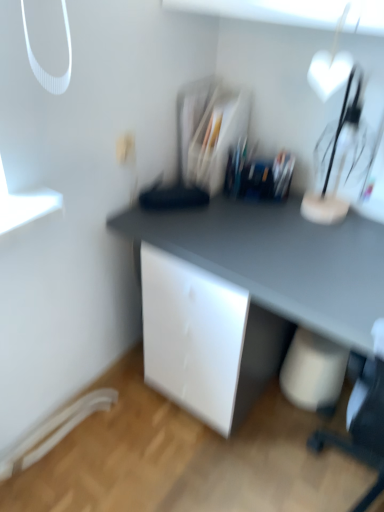
Question: Considering the positions of white glossy heart-shaped object at upper right and clear plastic organizer at center in the image, is white glossy heart-shaped object at upper right wider or thinner than clear plastic organizer at center?

Choices:
 (A) thin
 (B) wide

Answer: (A)

Question: From the image's perspective, is white glossy heart-shaped object at upper right located above or below clear plastic organizer at center?

Choices:
 (A) below
 (B) above

Answer: (A)

Question: Estimate the real-world distances between objects in this image. Which object is farther from the matte gray desk at center?

Choices:
 (A) white glossy heart-shaped object at upper right
 (B) white matte electric outlet at upper center
 (C) clear plastic organizer at center

Answer: (B)

Question: Estimate the real-world distances between objects in this image. Which object is closer to the white matte electric outlet at upper center?

Choices:
 (A) matte gray desk at center
 (B) white glossy heart-shaped object at upper right
 (C) clear plastic organizer at center

Answer: (C)